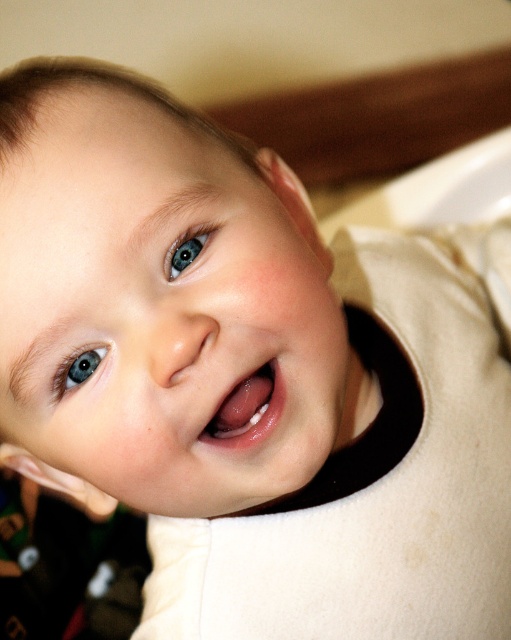
Is blue glossy eye at upper left shorter than blue glossy eye at upper center?

Yes, blue glossy eye at upper left is shorter than blue glossy eye at upper center.

Between point (76, 369) and point (193, 237), which one is positioned behind?

The point (193, 237) is more distant.

Where is `blue glossy eye at upper left`? The width and height of the screenshot is (511, 640). blue glossy eye at upper left is located at coordinates (78, 369).

Who is shorter, pink glossy tongue at center or blue glossy eye at upper center?

blue glossy eye at upper center is shorter.

Based on the photo, does pink glossy tongue at center have a greater height compared to blue glossy eye at upper center?

Yes.

Find the location of a particular element. pink glossy tongue at center is located at coordinates (246, 410).

Does pink glossy tongue at center appear over blue glossy eye at upper left?

Actually, pink glossy tongue at center is below blue glossy eye at upper left.

Can you confirm if pink glossy tongue at center is positioned below blue glossy eye at upper left?

Indeed, pink glossy tongue at center is positioned under blue glossy eye at upper left.

Which is behind, point (213, 438) or point (59, 392)?

Positioned behind is point (59, 392).

The height and width of the screenshot is (640, 511). Identify the location of pink glossy tongue at center. (246, 410).